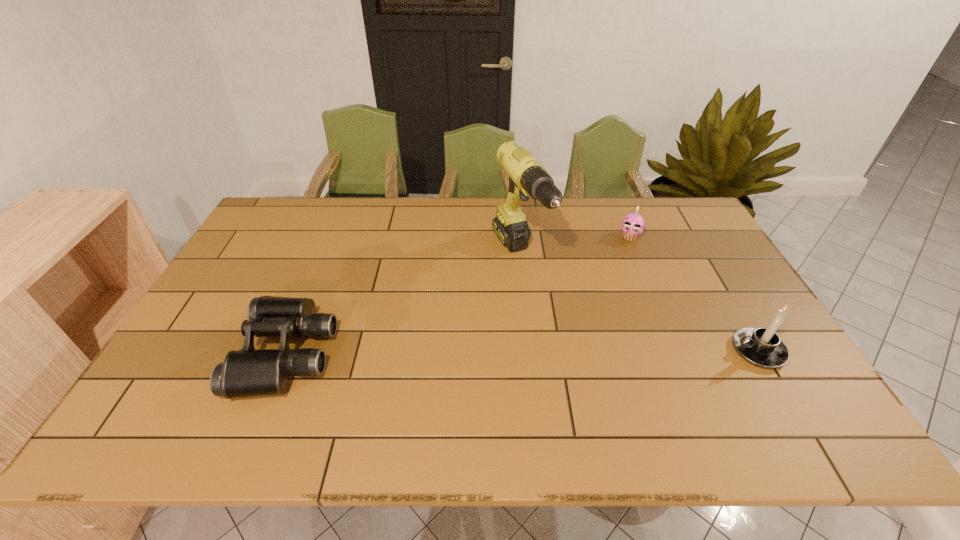
Where is `free spot on the desktop that is between the binoculars and the second tallest object and is positioned on the handle side of the drill`? This screenshot has height=540, width=960. free spot on the desktop that is between the binoculars and the second tallest object and is positioned on the handle side of the drill is located at coordinates (588, 352).

At what (x,y) coordinates should I click in order to perform the action: click on free space on the desktop that is between the leftmost object and the candle holder and is positioned on the face of the cupcake. Please return your answer as a coordinate pair (x, y). The width and height of the screenshot is (960, 540). Looking at the image, I should click on (585, 352).